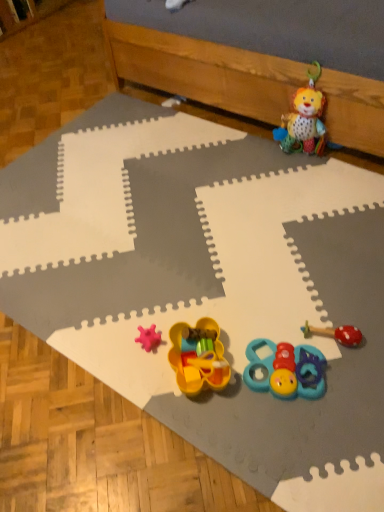
Image resolution: width=384 pixels, height=512 pixels. What are the coordinates of `vacant space that's between teal rubber teething toy at lower center, the 3th toy when ordered from back to front, and red rubber teething ring at lower right, which is the 2th toy in back-to-front order` in the screenshot? It's located at (335, 355).